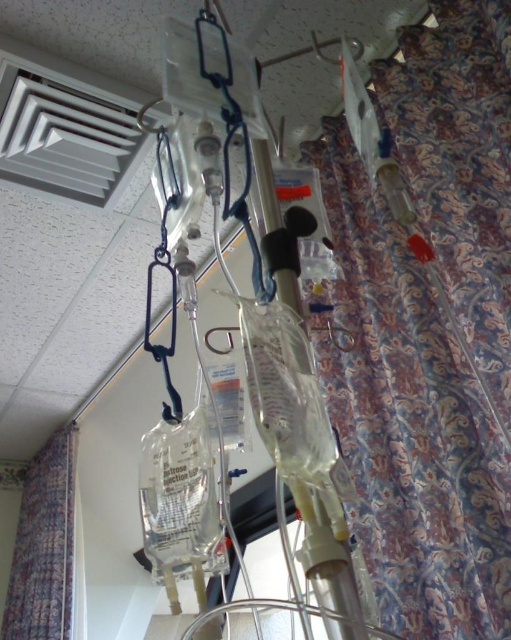
Question: Does patterned fabric curtain at right have a lesser width compared to patterned fabric curtain at left?

Choices:
 (A) yes
 (B) no

Answer: (A)

Question: Can you confirm if patterned fabric curtain at right is bigger than patterned fabric curtain at left?

Choices:
 (A) no
 (B) yes

Answer: (B)

Question: Which of the following is the closest to the observer?

Choices:
 (A) (444, 24)
 (B) (32, 614)

Answer: (A)

Question: Among these objects, which one is farthest from the camera?

Choices:
 (A) patterned fabric curtain at right
 (B) patterned fabric curtain at left

Answer: (B)

Question: Which of the following is the closest to the observer?

Choices:
 (A) (415, 413)
 (B) (74, 440)

Answer: (A)

Question: Can you confirm if patterned fabric curtain at right is positioned above patterned fabric curtain at left?

Choices:
 (A) no
 (B) yes

Answer: (B)